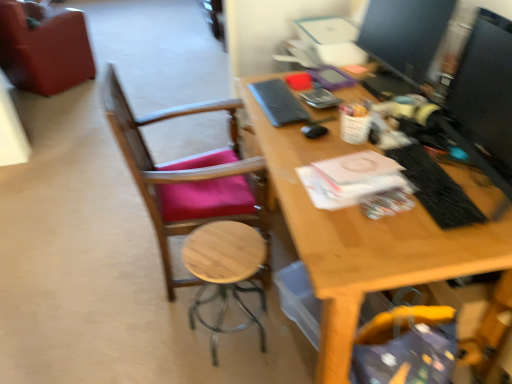
Image resolution: width=512 pixels, height=384 pixels. I want to click on vacant area situated below wooden stool at center (from a real-world perspective), so click(228, 328).